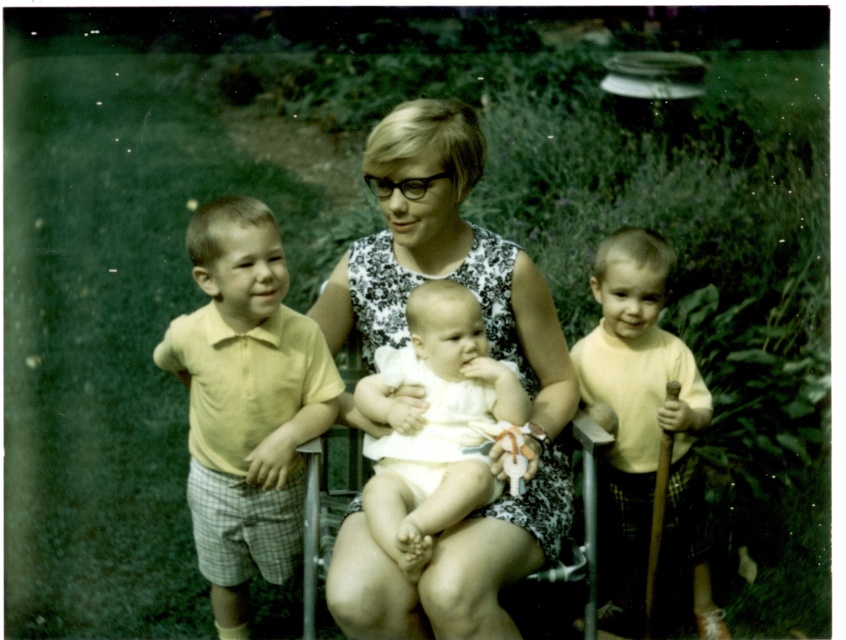
You are a photographer setting up a photo shoot in a garden. You have two outfits to choose from for the main subject. The options are the white floral dress at center and the yellow matte shirt at right. Based on the scene description, which outfit is more appropriate for the garden setting and why?

The white floral dress at center is more appropriate for the garden setting because it is bigger than the yellow matte shirt at right, making it more visible and suitable for outdoor photography.